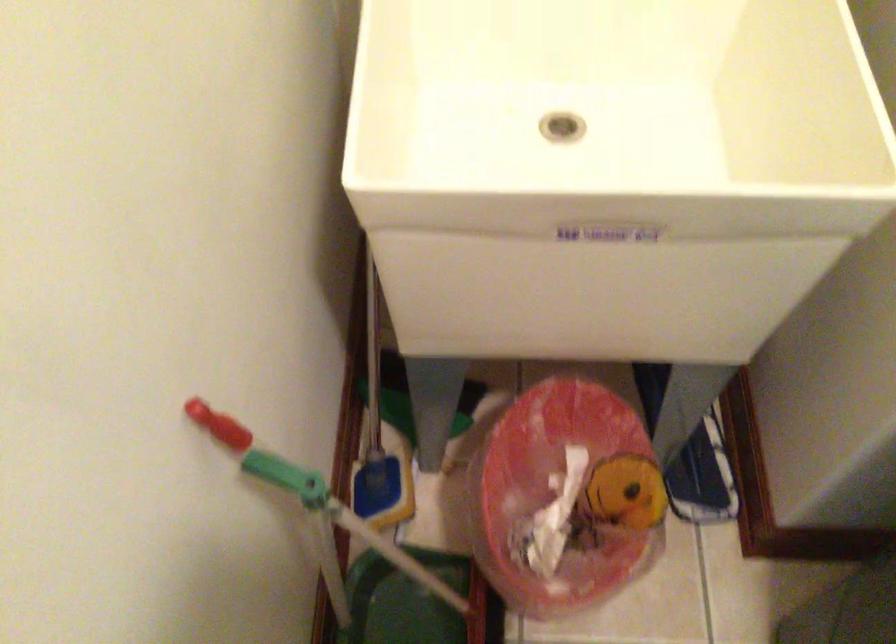
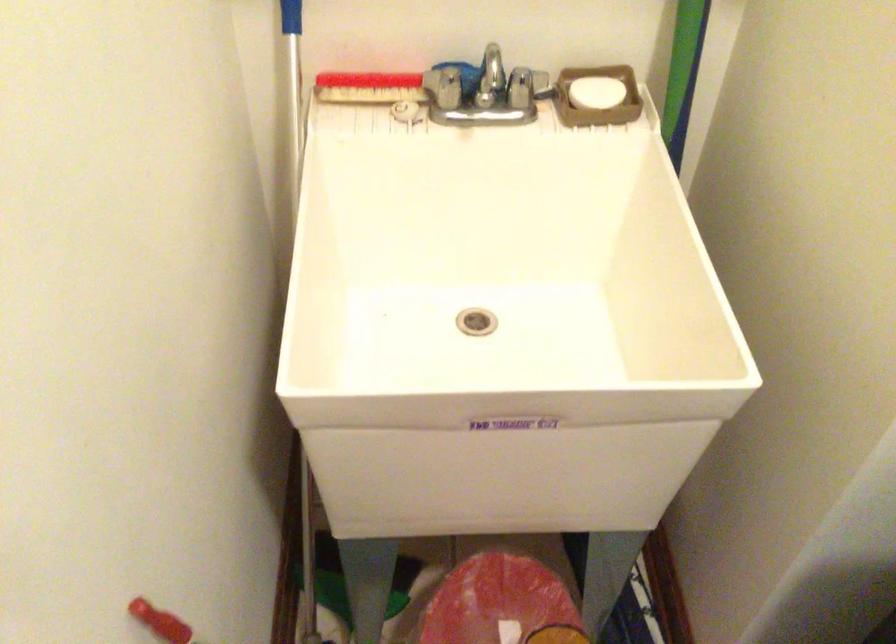
Question: How did the camera likely rotate?

Choices:
 (A) Left
 (B) Right
 (C) Up
 (D) Down

Answer: (C)